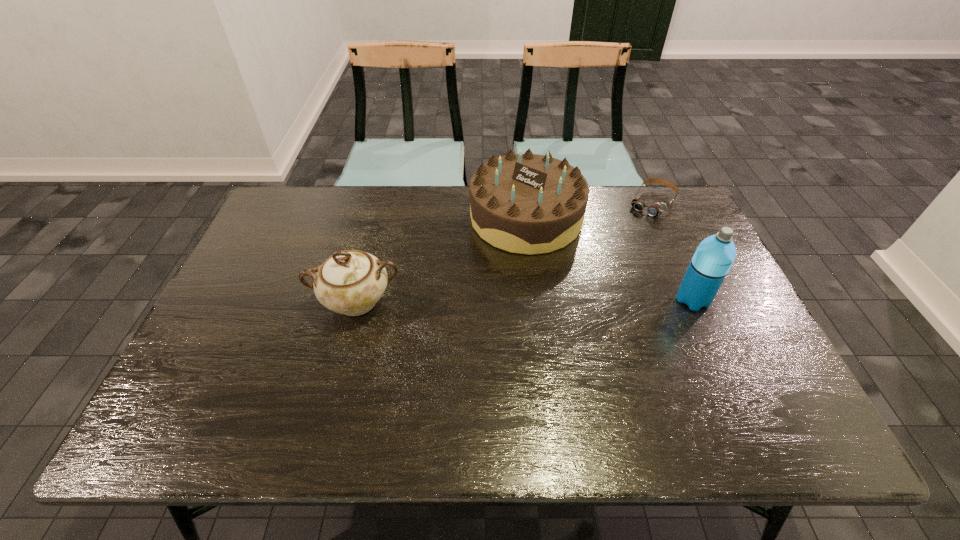
The image size is (960, 540). Identify the location of free spot located 0.210m on the front-facing side of the shortest object. (614, 252).

I want to click on vacant region located on the front-facing side of the shortest object, so click(x=598, y=273).

Locate an element on the screen. The width and height of the screenshot is (960, 540). birthday cake present at the far edge is located at coordinates (527, 203).

The image size is (960, 540). Identify the location of goggles situated at the far edge. (656, 209).

This screenshot has height=540, width=960. In order to click on thermos bottle located at the right edge in this screenshot , I will do (711, 262).

Where is `goggles at the right edge`? goggles at the right edge is located at coordinates (656, 209).

Identify the location of object that is at the far right corner. The image size is (960, 540). (656, 209).

Locate an element on the screen. The width and height of the screenshot is (960, 540). vacant space at the far edge of the desktop is located at coordinates (423, 219).

Identify the location of vacant position at the near edge of the desktop. This screenshot has height=540, width=960. 544,367.

Identify the location of vacant space at the right edge. The height and width of the screenshot is (540, 960). pyautogui.click(x=722, y=341).